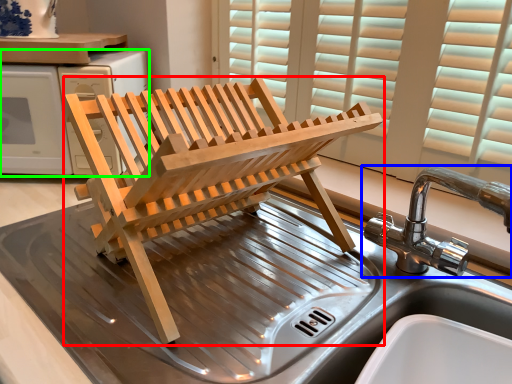
Question: Based on their relative distances, which object is nearer to furniture (highlighted by a red box)? Choose from tap (highlighted by a blue box) and appliance (highlighted by a green box).

Choices:
 (A) tap
 (B) appliance

Answer: (B)